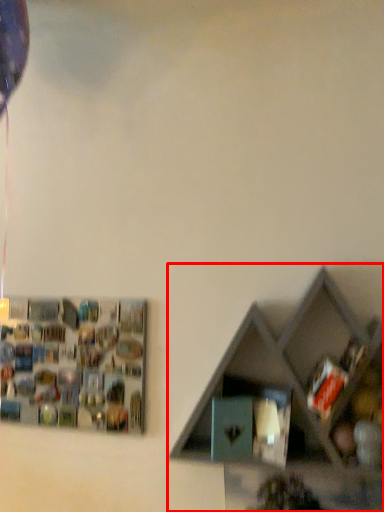
Question: From the image's perspective, where is shelf (annotated by the red box) located in relation to shelf in the image?

Choices:
 (A) above
 (B) below

Answer: (A)